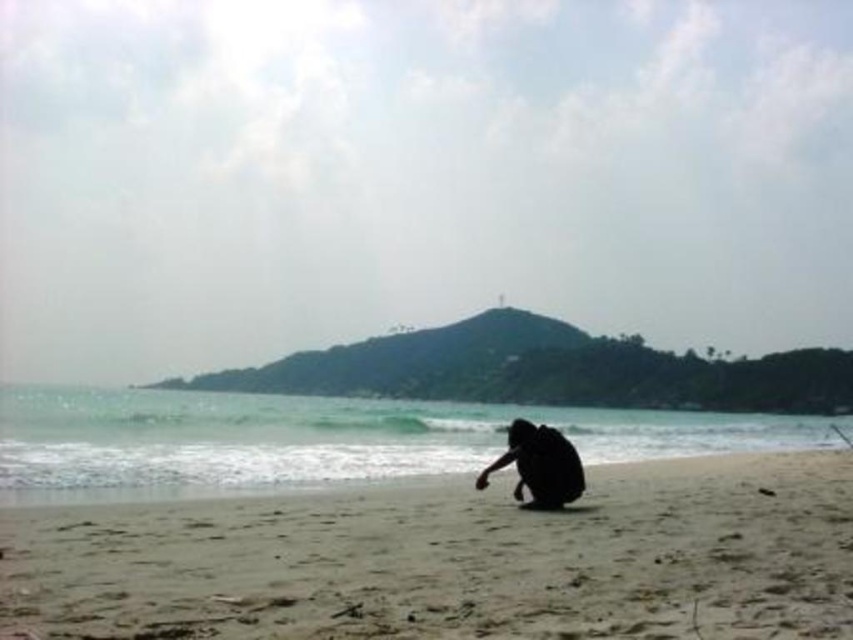
Which of these two, sandy beach at lower center or black matte person at center, stands shorter?

Standing shorter between the two is sandy beach at lower center.

Who is positioned more to the left, sandy beach at lower center or black matte person at center?

black matte person at center is more to the left.

Is point (631, 589) positioned before point (531, 429)?

Yes, it is in front of point (531, 429).

Where is `sandy beach at lower center`? The height and width of the screenshot is (640, 853). sandy beach at lower center is located at coordinates (453, 561).